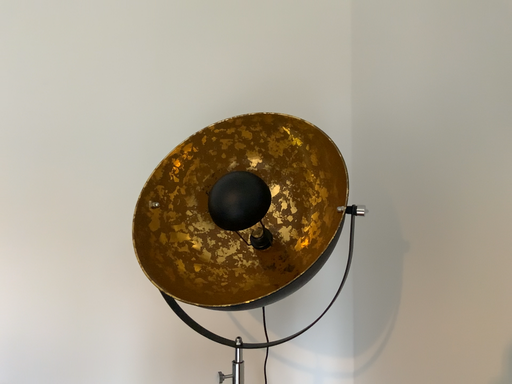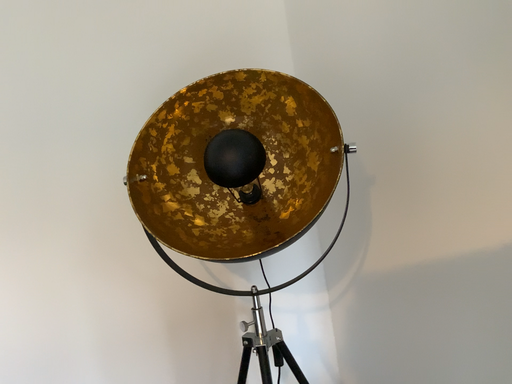
Question: How did the camera likely rotate when shooting the video?

Choices:
 (A) rotated right
 (B) rotated left

Answer: (A)